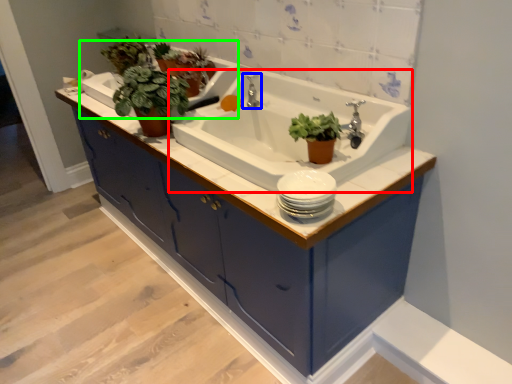
Question: Which is farther away from sink (highlighted by a red box)? tap (highlighted by a blue box) or bath (highlighted by a green box)?

Choices:
 (A) tap
 (B) bath

Answer: (B)